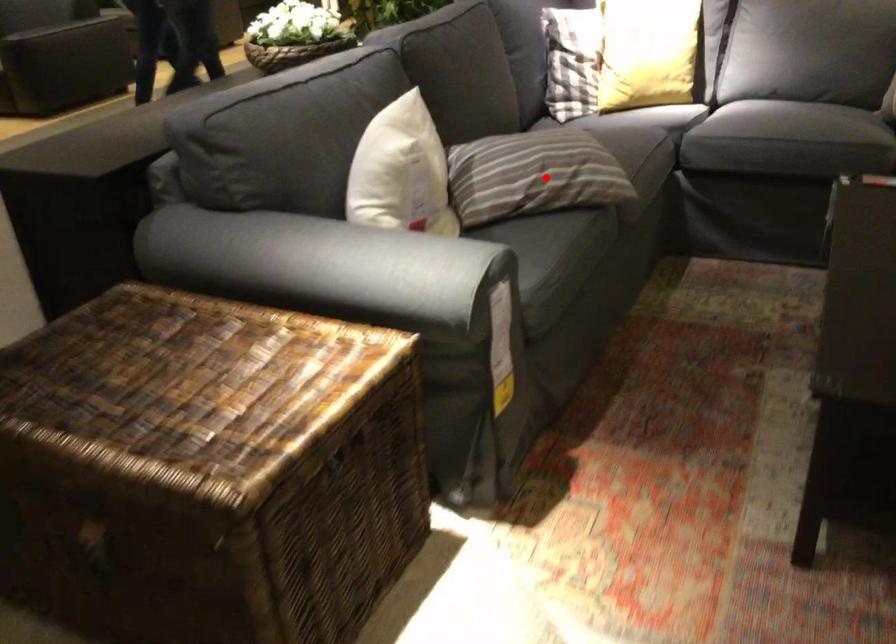
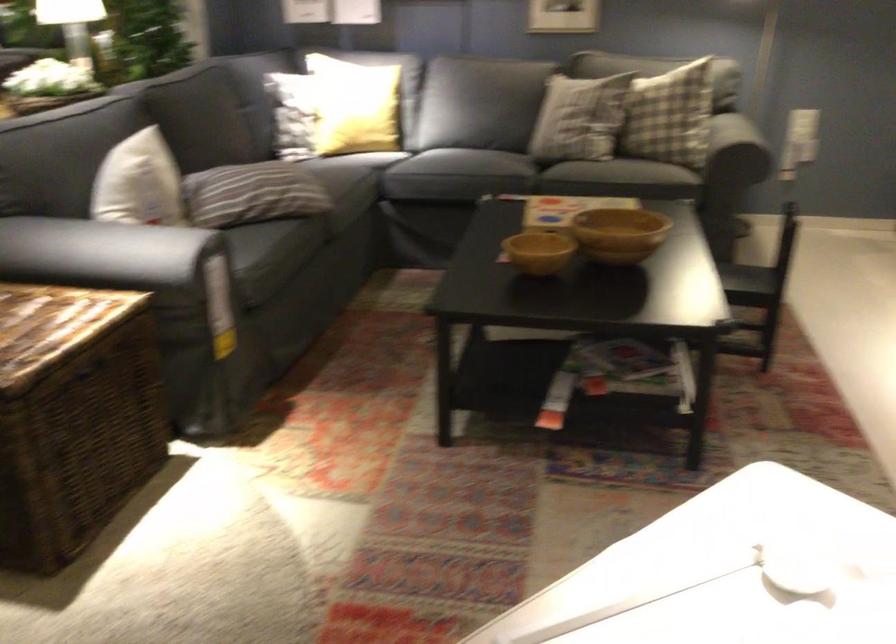
Locate, in the second image, the point that corresponds to the highlighted location in the first image.

(261, 194)